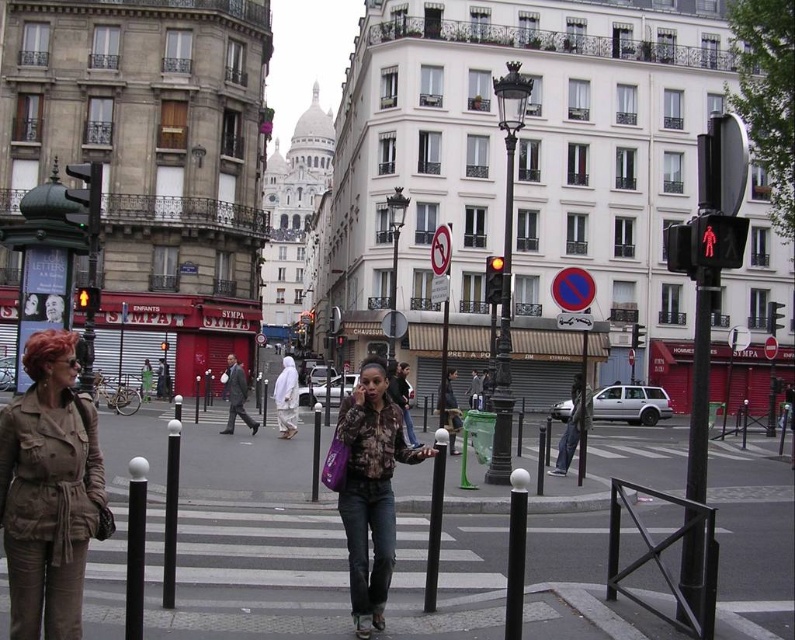
Question: Can you confirm if metallic traffic light at upper right is positioned above metallic traffic light at center?

Choices:
 (A) yes
 (B) no

Answer: (A)

Question: Which object is positioned farthest from the white fabric dress at center?

Choices:
 (A) light brown fabric coat at center
 (B) metallic traffic light at upper right

Answer: (B)

Question: Which object is positioned farthest from the metallic traffic light at center?

Choices:
 (A) yellow glass traffic light at center
 (B) light brown fabric coat at center

Answer: (A)

Question: Which point appears closest to the camera in this image?

Choices:
 (A) (638, 324)
 (B) (580, 385)
 (C) (371, 412)
 (D) (344, 337)

Answer: (C)

Question: Observing the image, what is the correct spatial positioning of white fabric dress at center in reference to metallic red traffic light at center?

Choices:
 (A) above
 (B) below

Answer: (B)

Question: Is matte brown trench coat at lower left smaller than camouflage jacket at center?

Choices:
 (A) no
 (B) yes

Answer: (B)